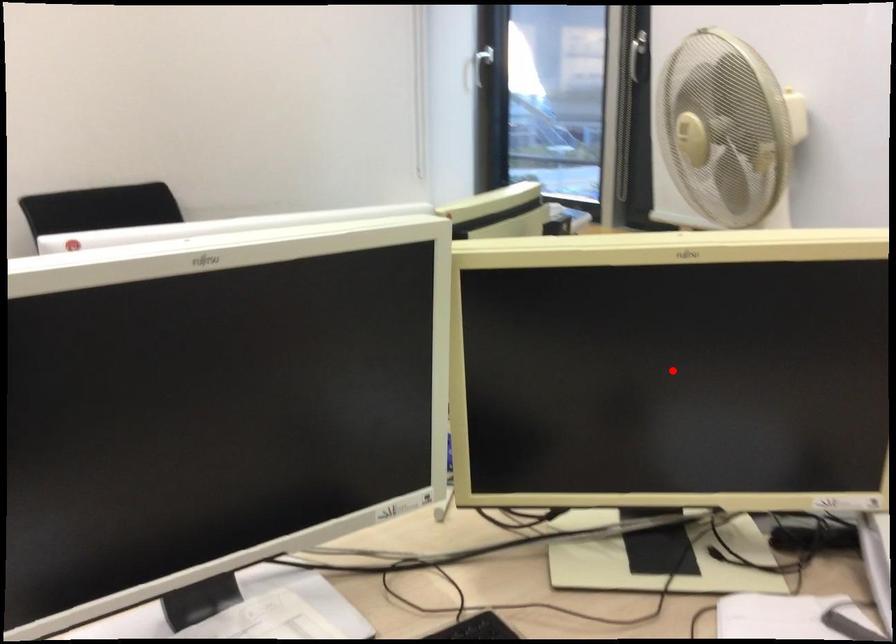
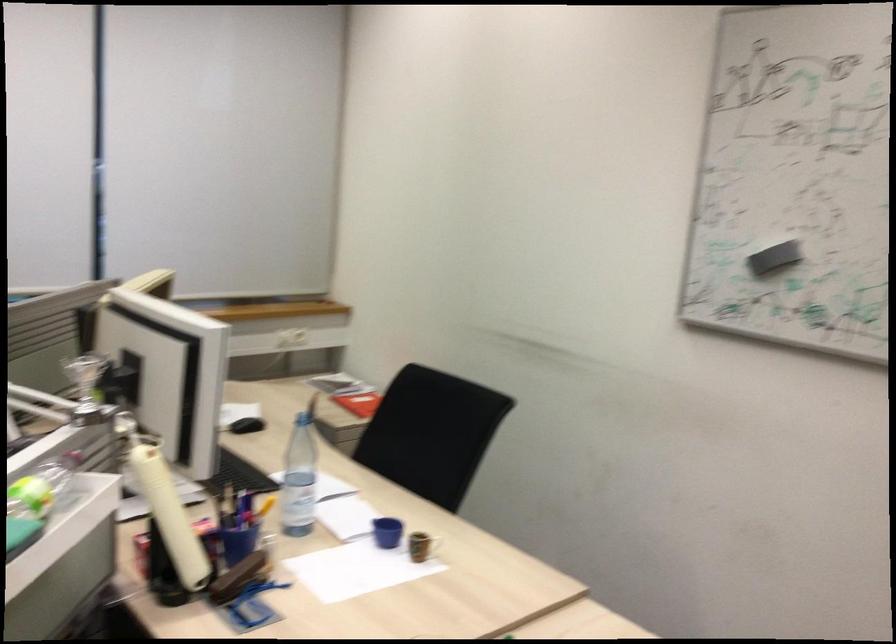
Question: I am providing you with two images of the same scene from different viewpoints. A red point is marked on the first image. Is the red point's position out of view in image 2?

Choices:
 (A) Yes
 (B) No

Answer: (A)